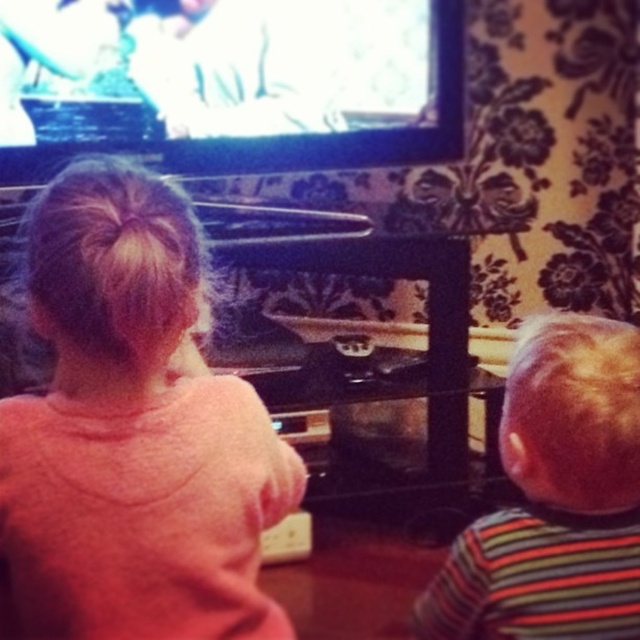
Question: Is pink fleece sweatshirt at upper left positioned in front of striped fabric shirt at right?

Choices:
 (A) yes
 (B) no

Answer: (A)

Question: Which point appears farthest from the camera in this image?

Choices:
 (A) (189, 353)
 (B) (634, 616)

Answer: (A)

Question: Does pink fleece sweatshirt at upper left have a greater width compared to striped fabric shirt at right?

Choices:
 (A) no
 (B) yes

Answer: (B)

Question: From the image, what is the correct spatial relationship of pink fleece sweatshirt at upper left in relation to striped fabric shirt at right?

Choices:
 (A) right
 (B) left

Answer: (B)

Question: Which point is farther to the camera?

Choices:
 (A) (257, 442)
 (B) (513, 432)

Answer: (B)